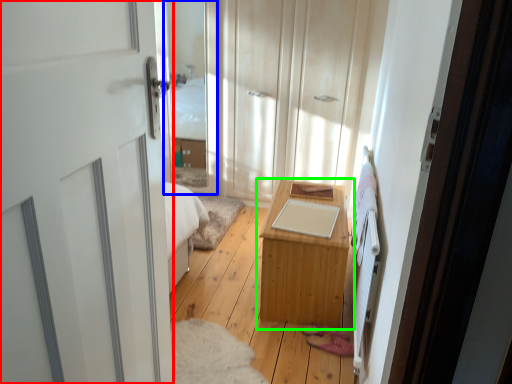
Question: Estimate the real-world distances between objects in this image. Which object is closer to door (highlighted by a red box), glass door (highlighted by a blue box) or table (highlighted by a green box)?

Choices:
 (A) glass door
 (B) table

Answer: (B)